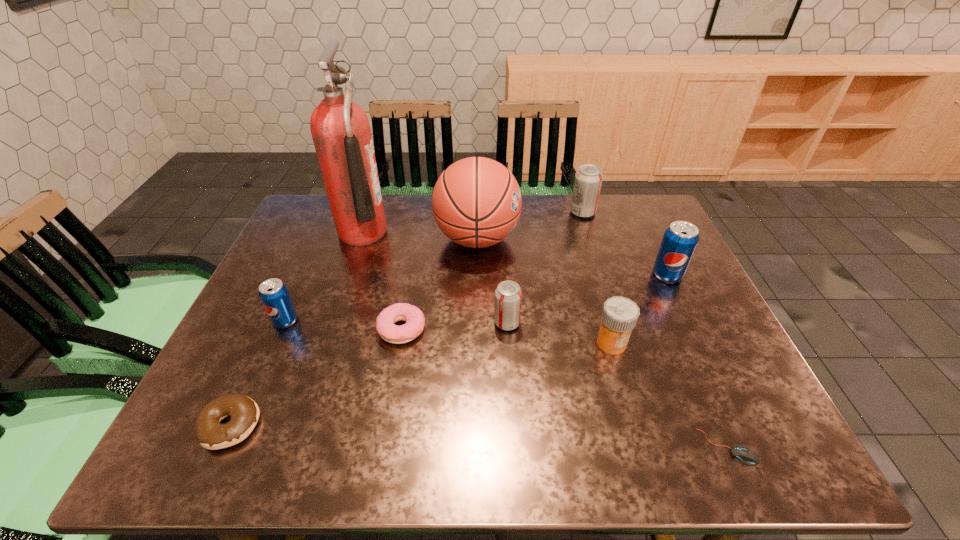
Locate which soda can is the closest to the basketball. Please provide its 2D coordinates. Your answer should be formatted as a tuple, i.e. [(x, y)], where the tuple contains the x and y coordinates of a point satisfying the conditions above.

[(588, 180)]

The height and width of the screenshot is (540, 960). Identify the location of vacant space that satisfies the following two spatial constraints: 1. on the back side of the right doughnut; 2. on the front of the eighth object from right to left near the operation label. (419, 232).

Where is `free space in the image that satisfies the following two spatial constraints: 1. on the logo side of the third soda can from right to left; 2. on the left side of the second tallest object`? Image resolution: width=960 pixels, height=540 pixels. free space in the image that satisfies the following two spatial constraints: 1. on the logo side of the third soda can from right to left; 2. on the left side of the second tallest object is located at coordinates (476, 323).

This screenshot has width=960, height=540. Identify the location of vacant space that satisfies the following two spatial constraints: 1. on the back side of the second soda can from left to right; 2. on the right side of the rightmost soda can. (504, 275).

This screenshot has height=540, width=960. In order to click on vacant space that satisfies the following two spatial constraints: 1. on the logo side of the smaller gray soda can; 2. on the right side of the ninth shortest object in this screenshot , I will do `click(476, 323)`.

Find the location of a particular element. free space that satisfies the following two spatial constraints: 1. on the logo side of the right blue pop soda; 2. on the right side of the orange basketball is located at coordinates (477, 275).